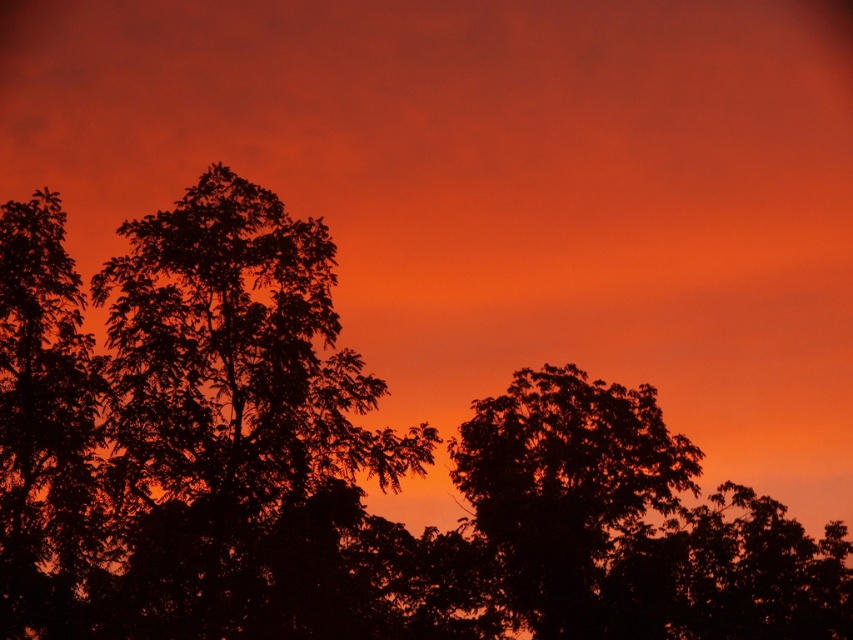
In the scene shown: Between silhouette tree at center and silhouette leafy tree at left, which one appears on the right side from the viewer's perspective?

silhouette tree at center is more to the right.

Can you confirm if silhouette tree at center is taller than silhouette leafy tree at left?

No, silhouette tree at center is not taller than silhouette leafy tree at left.

Is point (604, 496) positioned before point (20, 342)?

No, it is not.

This screenshot has height=640, width=853. In order to click on silhouette tree at center in this screenshot , I will do `click(564, 484)`.

Who is more forward, (296, 220) or (45, 600)?

Point (45, 600)

Locate an element on the screen. silhouette leafy tree at center is located at coordinates (241, 426).

Which is above, silhouette leafy tree at center or silhouette tree at center?

silhouette leafy tree at center

The height and width of the screenshot is (640, 853). What do you see at coordinates (241, 426) in the screenshot?
I see `silhouette leafy tree at center` at bounding box center [241, 426].

What do you see at coordinates (241, 426) in the screenshot? I see `silhouette leafy tree at center` at bounding box center [241, 426].

Where is `silhouette leafy tree at center`? The image size is (853, 640). silhouette leafy tree at center is located at coordinates (241, 426).